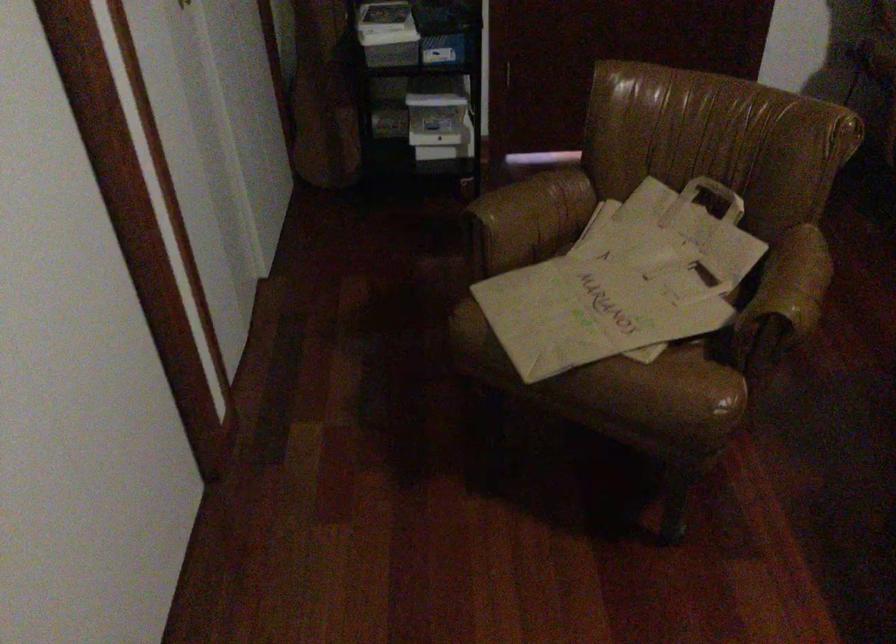
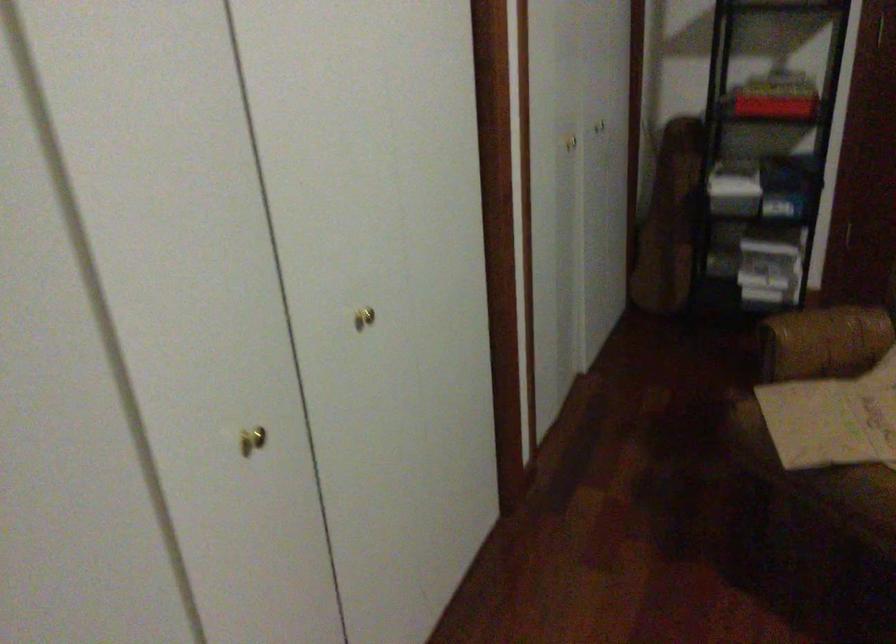
What movement of the cameraman would produce the second image?

The cameraman walked toward right, backward.